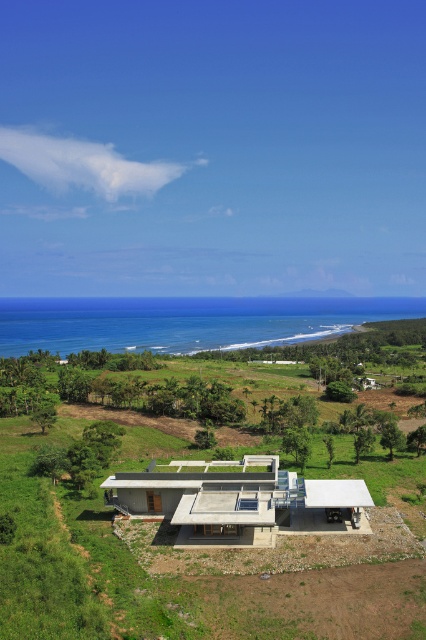
You are standing at the point marked as point (x=184, y=321) in the image. What is the closest object to you in the scene?

The closest object to you at point (x=184, y=321) is the blue ocean at lower center, as the point marks its location.

You are standing at the entrance of the modern house and want to reach the blue ocean at lower center. According to the coordinates provided, in which direction should you walk to reach it?

The blue ocean at lower center is located at point (184, 321), which means it is positioned to the lower part of the image. Since you are at the entrance of the house, you should walk towards the lower direction to reach the blue ocean at lower center.